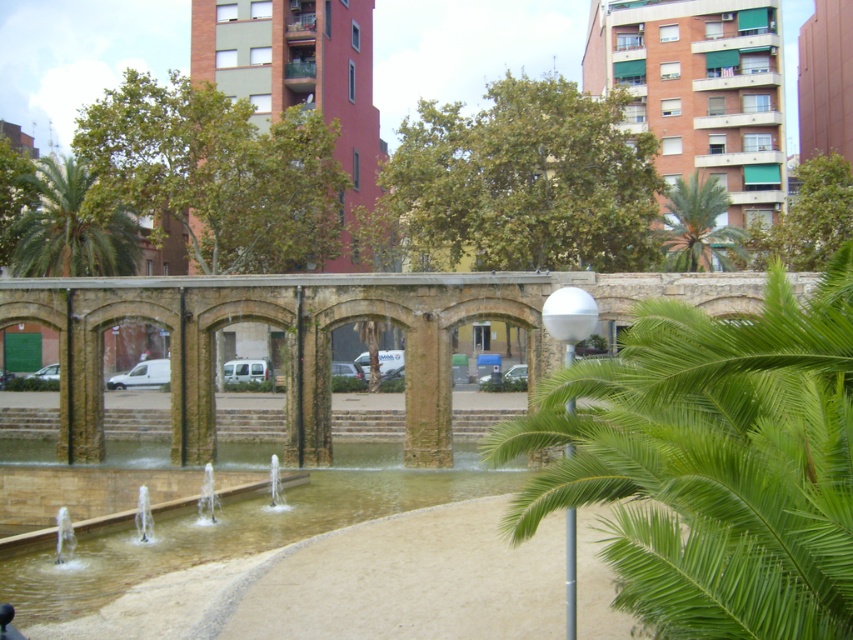
Is point (265, 516) farther from viewer compared to point (107, 234)?

No, it is not.

Who is taller, clear water at center or green leafy palm tree at left?

Standing taller between the two is green leafy palm tree at left.

The width and height of the screenshot is (853, 640). Describe the element at coordinates (242, 528) in the screenshot. I see `clear water at center` at that location.

Locate an element on the screen. clear water at center is located at coordinates (242, 528).

Is green leafy palm tree at left above green leafy palm tree at upper right?

No.

Can you confirm if green leafy palm tree at left is thinner than green leafy palm tree at upper right?

No, green leafy palm tree at left is not thinner than green leafy palm tree at upper right.

Between point (44, 268) and point (718, 193), which one is positioned in front?

Point (44, 268) is in front.

Locate an element on the screen. green leafy palm tree at left is located at coordinates click(x=68, y=227).

Is green leafy palm tree at center bigger than clear water at center?

No, green leafy palm tree at center is not bigger than clear water at center.

What are the coordinates of `green leafy palm tree at center` in the screenshot? It's located at (712, 464).

The image size is (853, 640). I want to click on green leafy palm tree at center, so click(712, 464).